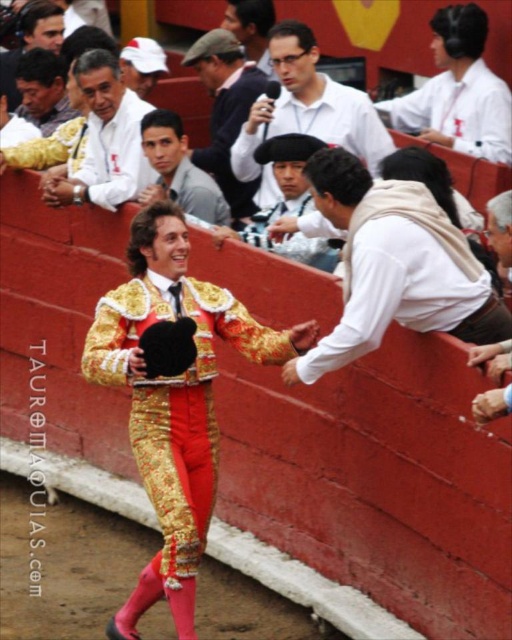
Question: Which point is farther from the camera taking this photo?

Choices:
 (A) (307, 80)
 (B) (483, 76)
 (C) (60, 29)

Answer: (C)

Question: Which point is farther to the camera?

Choices:
 (A) white cotton shirt at upper right
 (B) smooth skin face at center
 (C) smooth skin face at upper left

Answer: (C)

Question: In this image, where is white cotton shirt at upper right located relative to smooth leather jacket at upper left?

Choices:
 (A) right
 (B) left

Answer: (A)

Question: Can you confirm if gold brocade suit at center is thinner than smooth leather jacket at upper left?

Choices:
 (A) yes
 (B) no

Answer: (A)

Question: Which of these objects is positioned farthest from the white cotton hat at upper left?

Choices:
 (A) smooth leather jacket at upper left
 (B) smooth brown hat at center
 (C) matte white shirt at upper center
 (D) white cotton shirt at upper left

Answer: (D)

Question: Does white fabric headband at upper center appear on the left side of smooth brown hat at center?

Choices:
 (A) no
 (B) yes

Answer: (A)